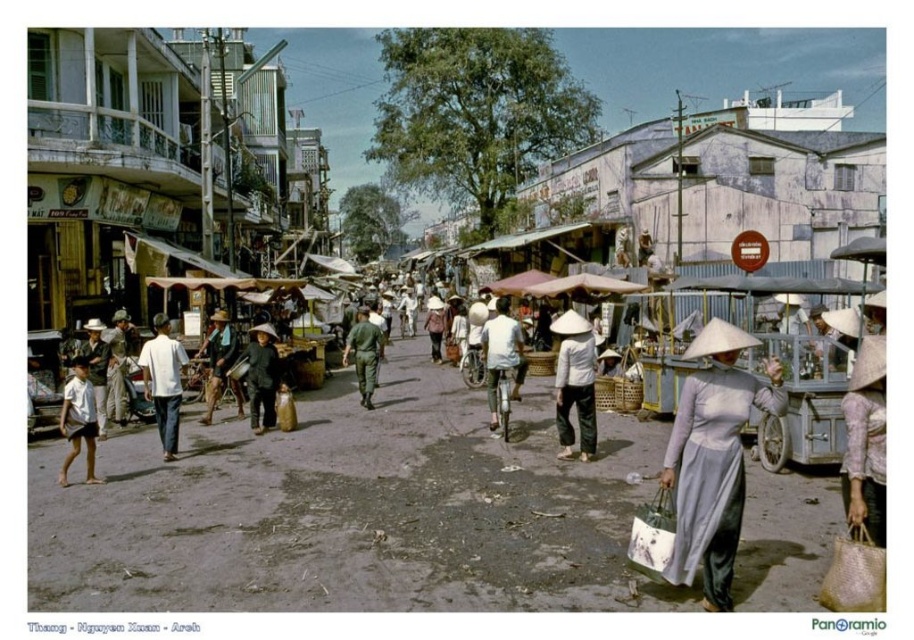
You are a photographer standing in the middle of the market. You notice two items at the center of the scene, the white matte ao dai at center and the white matte bicycle at center. Which one do you think is bigger in size?

The white matte ao dai at center is larger in size than the white matte bicycle at center, so the white matte ao dai at center is bigger.

You are a street vendor who needs to carry your goods from your stall to the main entrance. You see a white matte bicycle at center and a dark brown wooden stick at center. Which object is taller and can help you reach higher shelves?

The white matte bicycle at center is taller than the dark brown wooden stick at center, so it can help you reach higher shelves.